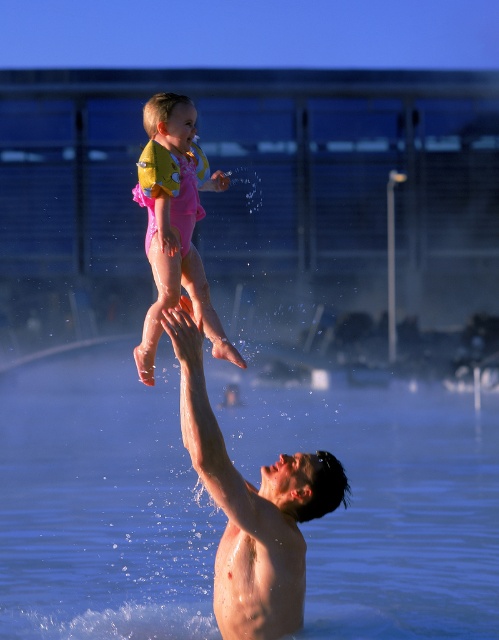
Question: Based on their relative distances, which object is farther from the pink rubber swimsuit at upper center?

Choices:
 (A) skinny white man at center
 (B) clear blue water at upper center

Answer: (B)

Question: Among these points, which one is nearest to the camera?

Choices:
 (A) (198, 266)
 (B) (219, 561)

Answer: (B)

Question: Can you confirm if clear blue water at upper center is positioned to the left of pink rubber swimsuit at upper center?

Choices:
 (A) yes
 (B) no

Answer: (B)

Question: Does clear blue water at upper center come in front of skinny white man at center?

Choices:
 (A) yes
 (B) no

Answer: (B)

Question: Based on their relative distances, which object is nearer to the clear blue water at upper center?

Choices:
 (A) pink rubber swimsuit at upper center
 (B) skinny white man at center

Answer: (A)

Question: Can you confirm if skinny white man at center is positioned below pink rubber swimsuit at upper center?

Choices:
 (A) yes
 (B) no

Answer: (A)